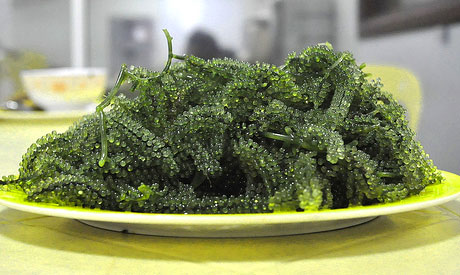
This screenshot has height=275, width=460. I want to click on white bottom face of plate, so click(259, 226).